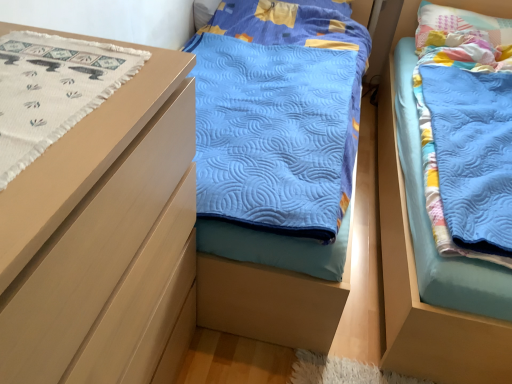
You are a GUI agent. You are given a task and a screenshot of the screen. Output one action in this format:
    pyautogui.click(x=<x>, y=<y>)
    Task: Click on the pastel patchwork pillow at upper right
    This screenshot has height=384, width=512.
    Given the screenshot: What is the action you would take?
    pyautogui.click(x=459, y=25)

What do you see at coordinates (459, 25) in the screenshot? The width and height of the screenshot is (512, 384). I see `pastel patchwork pillow at upper right` at bounding box center [459, 25].

Where is `matte wood chest of drawers at left`? This screenshot has height=384, width=512. matte wood chest of drawers at left is located at coordinates (103, 237).

What do you see at coordinates (53, 90) in the screenshot? I see `white woven fabric at left` at bounding box center [53, 90].

Where is `blue quilted blanket at right`? The height and width of the screenshot is (384, 512). blue quilted blanket at right is located at coordinates (416, 276).

From the image's perspective, between pastel patchwork pillow at upper right and blue quilted blanket at right, which one is located above?

pastel patchwork pillow at upper right.

Are pastel patchwork pillow at upper right and blue quilted blanket at right far apart?

Indeed, pastel patchwork pillow at upper right is not near blue quilted blanket at right.

What's the angular difference between pastel patchwork pillow at upper right and blue quilted blanket at right's facing directions?

The angular difference between pastel patchwork pillow at upper right and blue quilted blanket at right is 5.03e-05 degrees.

Is point (465, 22) closer or farther from the camera than point (493, 333)?

Point (465, 22).

Is point (158, 357) positioned after point (25, 136)?

Yes, it is.

Would you say matte wood chest of drawers at left contains white woven fabric at left?

Absolutely, white woven fabric at left is inside matte wood chest of drawers at left.

In the scene shown: Does matte wood chest of drawers at left come in front of white woven fabric at left?

That is True.

How distant is white woven fabric at left from matte wood chest of drawers at left?

The distance of white woven fabric at left from matte wood chest of drawers at left is 7.29 inches.

Is white woven fabric at left beside matte wood chest of drawers at left?

No, white woven fabric at left is not with matte wood chest of drawers at left.

From a real-world perspective, is white woven fabric at left over matte wood chest of drawers at left?

Yes.

Consider the image. Is white woven fabric at left to the left of matte wood chest of drawers at left from the viewer's perspective?

In fact, white woven fabric at left is to the right of matte wood chest of drawers at left.

Between matte wood chest of drawers at left and blue quilted blanket at right, which one appears on the right side from the viewer's perspective?

blue quilted blanket at right is more to the right.

From a real-world perspective, is matte wood chest of drawers at left positioned over blue quilted blanket at right based on gravity?

Yes.

Looking at this image, is matte wood chest of drawers at left taller than blue quilted blanket at right?

Yes, matte wood chest of drawers at left is taller than blue quilted blanket at right.

Which of these two, blue quilted blanket at right or white woven fabric at left, stands taller?

blue quilted blanket at right is taller.

Would you say blue quilted blanket at right is a long distance from white woven fabric at left?

Absolutely, blue quilted blanket at right is distant from white woven fabric at left.

From a real-world perspective, is blue quilted blanket at right positioned above or below white woven fabric at left?

blue quilted blanket at right is situated lower than white woven fabric at left in the real world.

Considering the positions of points (477, 324) and (129, 257), is point (477, 324) closer to camera compared to point (129, 257)?

No, it is not.

Which is in front, blue quilted blanket at right or matte wood chest of drawers at left?

matte wood chest of drawers at left is closer to the camera.

From the image's perspective, does blue quilted blanket at right appear higher than matte wood chest of drawers at left?

Yes.

Is blue quilted blanket at right beside matte wood chest of drawers at left?

No, blue quilted blanket at right is not touching matte wood chest of drawers at left.

From the image's perspective, is pastel patchwork pillow at upper right located above or below matte wood chest of drawers at left?

Clearly, from the image's perspective, pastel patchwork pillow at upper right is above matte wood chest of drawers at left.

Considering the relative sizes of pastel patchwork pillow at upper right and matte wood chest of drawers at left in the image provided, is pastel patchwork pillow at upper right bigger than matte wood chest of drawers at left?

Incorrect, pastel patchwork pillow at upper right is not larger than matte wood chest of drawers at left.

Is pastel patchwork pillow at upper right further to camera compared to matte wood chest of drawers at left?

Yes, the depth of pastel patchwork pillow at upper right is greater than that of matte wood chest of drawers at left.

Is point (431, 43) closer or farther from the camera than point (189, 136)?

Point (431, 43) is positioned farther from the camera compared to point (189, 136).

Identify the location of bed that is in front of the pastel patchwork pillow at upper right. The image size is (512, 384). (416, 276).

Where is `blanket above the matte wood chest of drawers at left (from the image's perspective)`? The image size is (512, 384). blanket above the matte wood chest of drawers at left (from the image's perspective) is located at coordinates (53, 90).

When comparing their distances from blue quilted blanket at right, does matte wood chest of drawers at left or pastel patchwork pillow at upper right seem closer?

Among the two, matte wood chest of drawers at left is located nearer to blue quilted blanket at right.

Estimate the real-world distances between objects in this image. Which object is closer to white woven fabric at left, pastel patchwork pillow at upper right or blue quilted blanket at right?

blue quilted blanket at right is closer to white woven fabric at left.

Estimate the real-world distances between objects in this image. Which object is closer to matte wood chest of drawers at left, blue quilted blanket at right or pastel patchwork pillow at upper right?

The object closer to matte wood chest of drawers at left is blue quilted blanket at right.

Considering their positions, is pastel patchwork pillow at upper right positioned further to blue quilted blanket at right than matte wood chest of drawers at left?

pastel patchwork pillow at upper right lies further to blue quilted blanket at right than the other object.

Considering their positions, is blue quilted blanket at right positioned closer to pastel patchwork pillow at upper right than white woven fabric at left?

blue quilted blanket at right lies closer to pastel patchwork pillow at upper right than the other object.

Looking at the image, which one is located closer to matte wood chest of drawers at left, white woven fabric at left or blue quilted blanket at right?

The object closer to matte wood chest of drawers at left is white woven fabric at left.

Estimate the real-world distances between objects in this image. Which object is closer to blue quilted blanket at right, pastel patchwork pillow at upper right or white woven fabric at left?

Among the two, white woven fabric at left is located nearer to blue quilted blanket at right.

Consider the image. Considering their positions, is blue quilted blanket at right positioned further to pastel patchwork pillow at upper right than matte wood chest of drawers at left?

Based on the image, matte wood chest of drawers at left appears to be further to pastel patchwork pillow at upper right.

Find the location of `bed between white woven fabric at left and pastel patchwork pillow at upper right`. bed between white woven fabric at left and pastel patchwork pillow at upper right is located at coordinates (416, 276).

This screenshot has width=512, height=384. I want to click on bed between matte wood chest of drawers at left and pastel patchwork pillow at upper right, so click(x=416, y=276).

Where is `blanket situated between matte wood chest of drawers at left and blue quilted blanket at right from left to right`? blanket situated between matte wood chest of drawers at left and blue quilted blanket at right from left to right is located at coordinates (53, 90).

Find the location of a particular element. The image size is (512, 384). blanket situated between matte wood chest of drawers at left and pastel patchwork pillow at upper right from left to right is located at coordinates (53, 90).